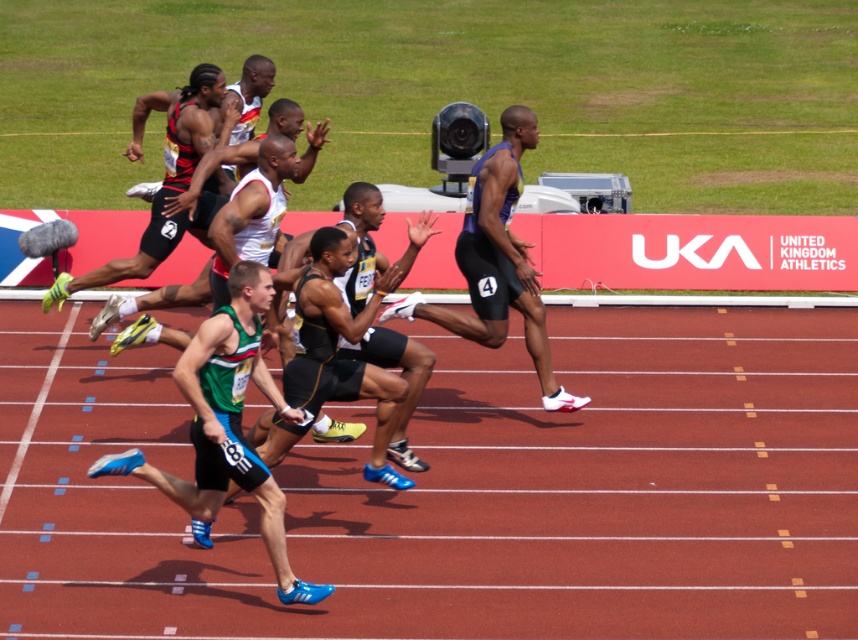
Question: Among these points, which one is farthest from the camera?

Choices:
 (A) (252, 180)
 (B) (524, 600)

Answer: (A)

Question: Observing the image, what is the correct spatial positioning of matte black shorts at center in reference to matte black shorts at left?

Choices:
 (A) above
 (B) below

Answer: (B)

Question: Which object is farther from the camera taking this photo?

Choices:
 (A) matte purple shorts at center
 (B) matte black shorts at center

Answer: (A)

Question: Can you confirm if matte purple shorts at center is positioned to the left of matte black shorts at center?

Choices:
 (A) yes
 (B) no

Answer: (B)

Question: Which of these objects is positioned farthest from the rubber track at center?

Choices:
 (A) green matte shorts at center
 (B) matte black shorts at left

Answer: (B)

Question: Does rubber track at center appear on the left side of matte black shorts at left?

Choices:
 (A) yes
 (B) no

Answer: (B)